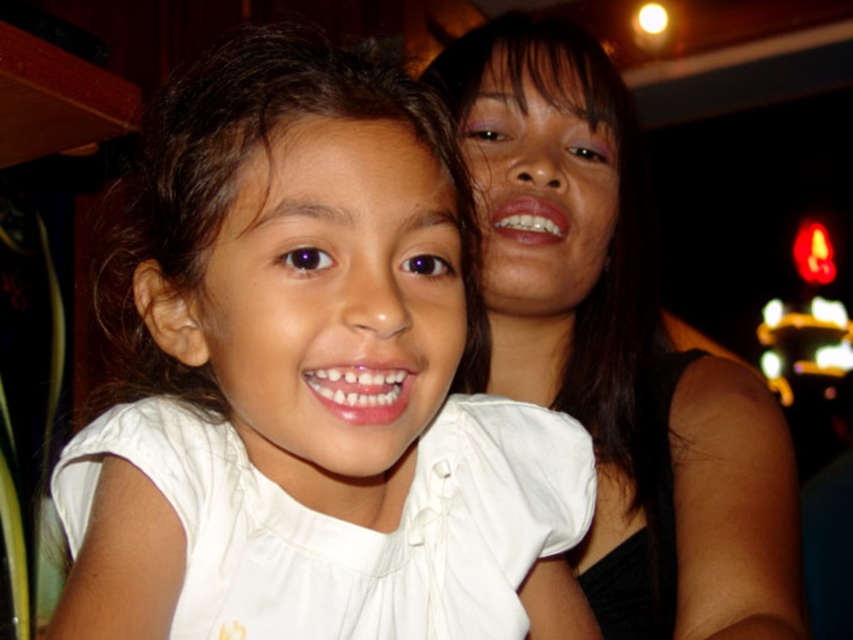
Which is more to the right, white matte shirt at center or matte black hair at upper right?

matte black hair at upper right

Is white matte shirt at center to the left of matte black hair at upper right from the viewer's perspective?

Yes, white matte shirt at center is to the left of matte black hair at upper right.

Where is `white matte shirt at center`? white matte shirt at center is located at coordinates (343, 323).

Locate an element on the screen. The width and height of the screenshot is (853, 640). white matte shirt at center is located at coordinates (343, 323).